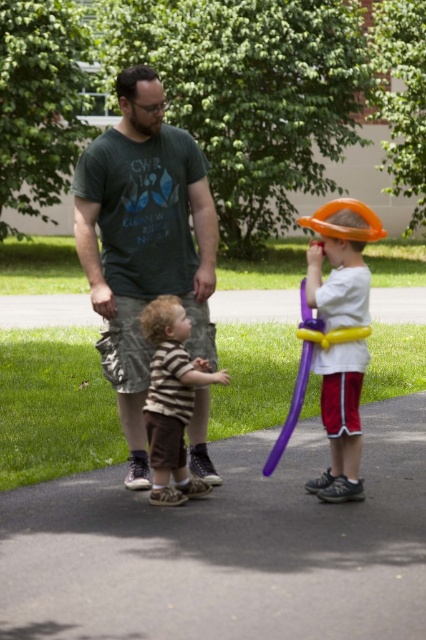
You are standing at the camera position and want to throw a ball to the point marked as point [181,348]. Is this point within a 5 meter range?

The distance of point [181,348] from camera is 6.05 meters, so the point is beyond the 5 meter range.

In the outdoor scene, there are a striped cotton shirt at center and an orange matte balloon at right. Which object is positioned to the left?

The striped cotton shirt at center is positioned to the left of the orange matte balloon at right.